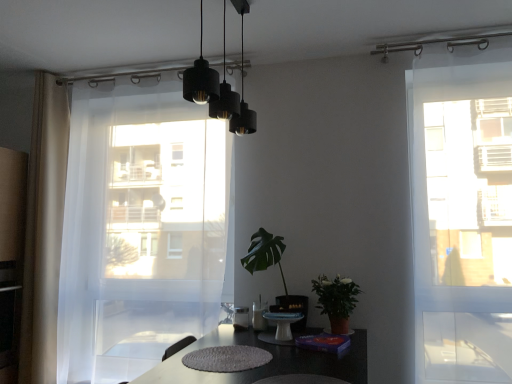
Where is `vacant space situated above transparent glass door at right (from a real-world perspective)`? vacant space situated above transparent glass door at right (from a real-world perspective) is located at coordinates (453, 33).